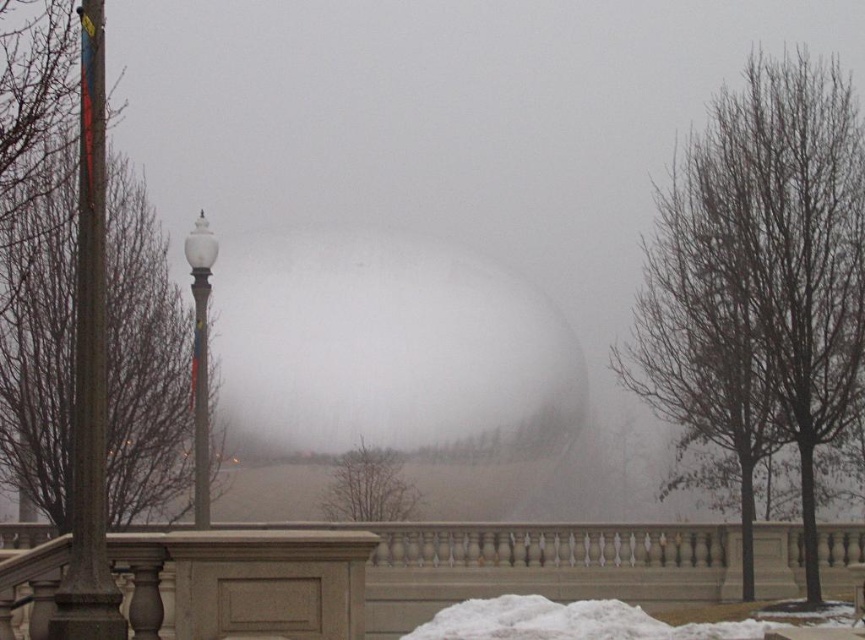
You are standing in the foggy area and see the metallic pole at left and the metallic gray pole at center. Which pole is higher in the scene?

The metallic pole at left is higher than the metallic gray pole at center.

You are standing in the foggy area and see the bare branches at center and the white glossy lamp post at left. Which object is closer to your left side?

The white glossy lamp post at left is closer to your left side because it is positioned to the left of the bare branches at center.

You are standing in the foggy scene and want to walk towards the large spherical structure in the background. Which object, the bare branches at center or the white glossy lamp post at left, is closer to you as you walk towards the sphere?

The bare branches at center are closer to you because they are positioned below the white glossy lamp post at left, indicating they are in a lower and nearer position relative to your viewpoint as you face the sphere.